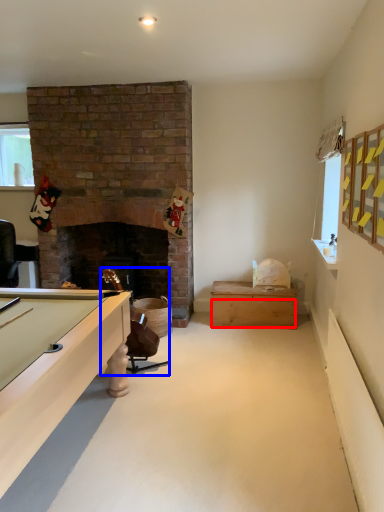
Question: Which of the following is the farthest to the observer, drawer (highlighted by a red box) or chair (highlighted by a blue box)?

Choices:
 (A) drawer
 (B) chair

Answer: (A)